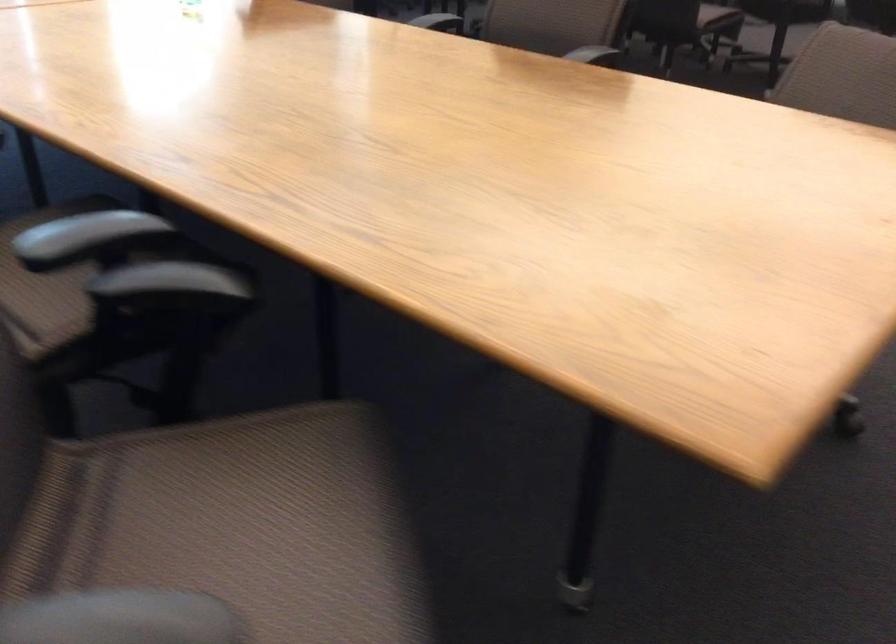
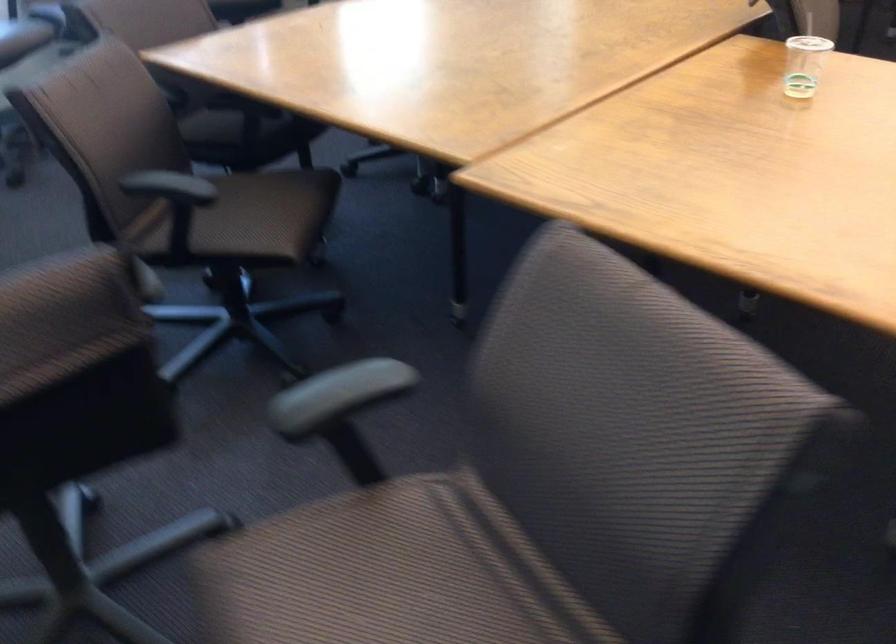
Question: The images are taken continuously from a first-person perspective. In which direction are you moving?

Choices:
 (A) Left
 (B) Right
 (C) Forward
 (D) Backward

Answer: (D)